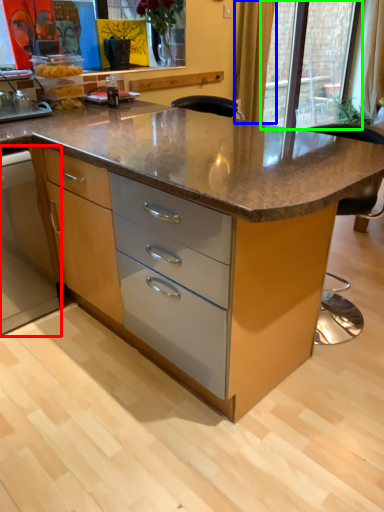
Question: Which is nearer to the cabinetry (highlighted by a red box)? curtain (highlighted by a blue box) or glass door (highlighted by a green box).

Choices:
 (A) curtain
 (B) glass door

Answer: (A)